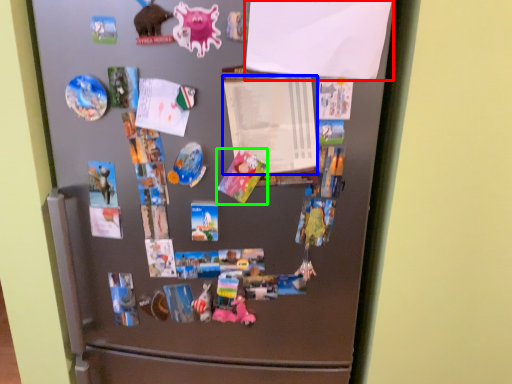
Question: Estimate the real-world distances between objects in this image. Which object is closer to paper (highlighted by a red box), paper (highlighted by a blue box) or art (highlighted by a green box)?

Choices:
 (A) paper
 (B) art

Answer: (A)